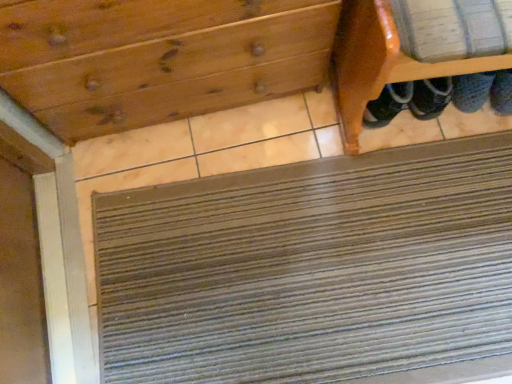
Find the location of `free region under brown textured mat at lower center (from a real-world perspective)`. free region under brown textured mat at lower center (from a real-world perspective) is located at coordinates (322, 276).